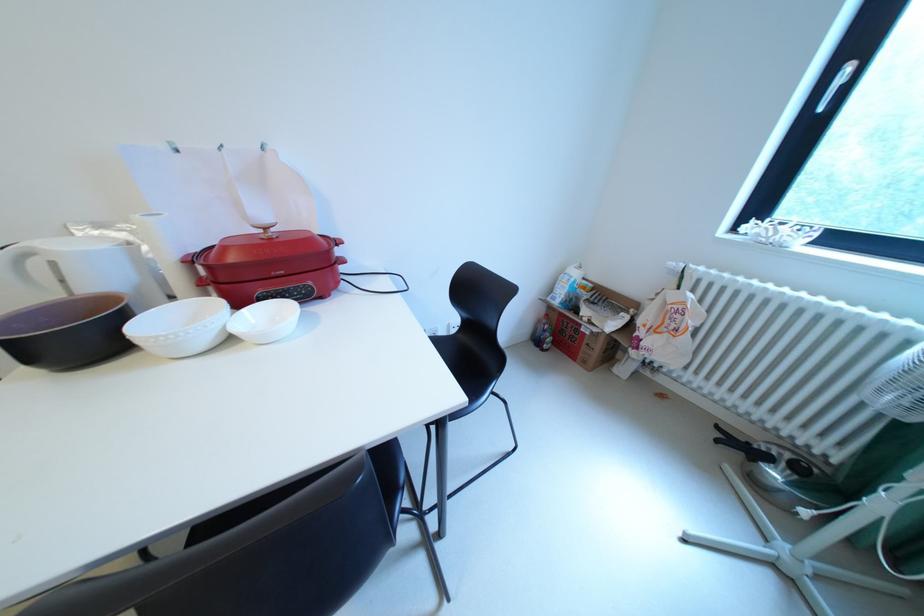
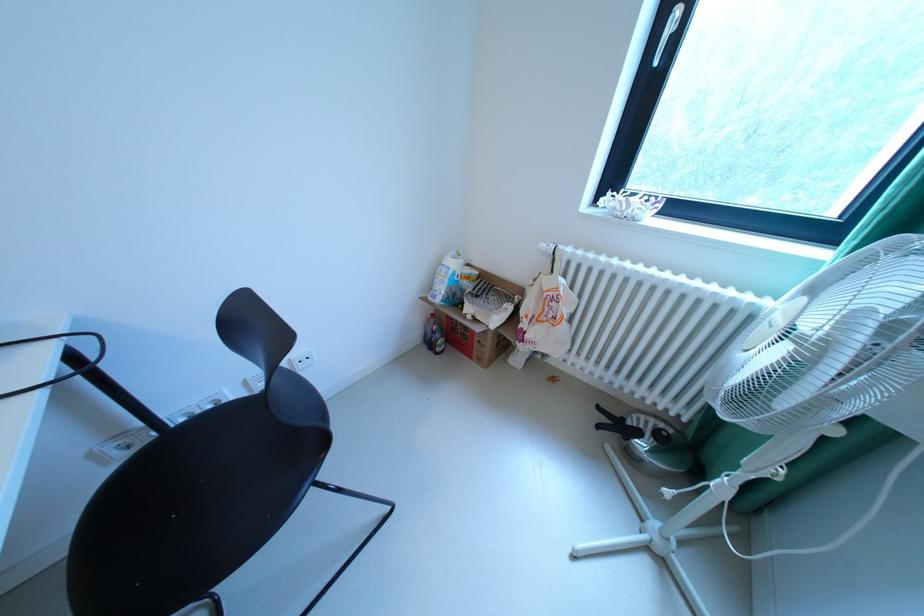
Find the pixel in the second image that matches (683,328) in the first image.

(561, 317)